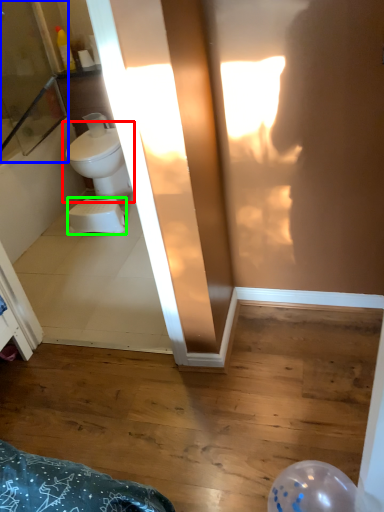
Question: Which is nearer to the toilet (highlighted by a red box)? screen door (highlighted by a blue box) or toilet bowl (highlighted by a green box).

Choices:
 (A) screen door
 (B) toilet bowl

Answer: (B)